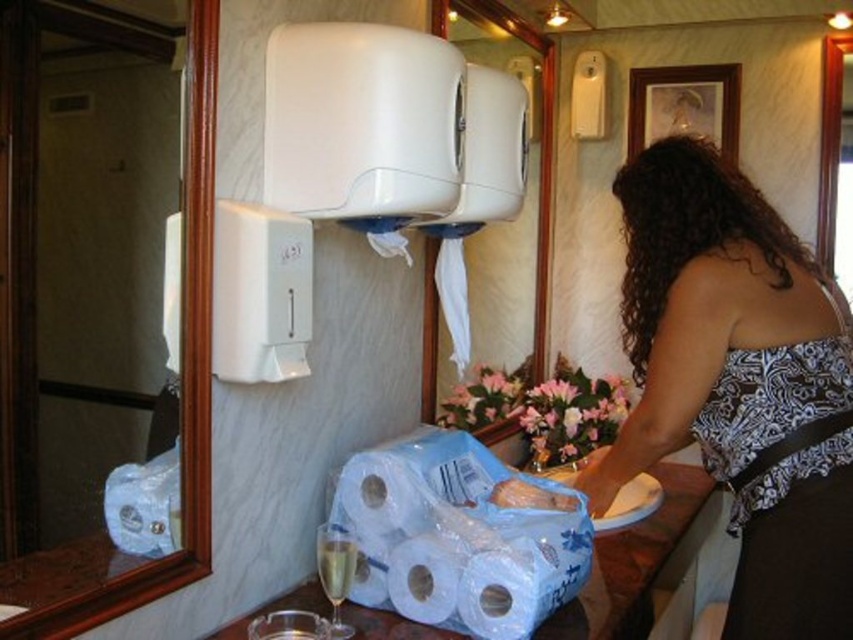
Question: Is white matte paper towel at lower center closer to the viewer compared to clear glass wine glass at lower left?

Choices:
 (A) no
 (B) yes

Answer: (A)

Question: Estimate the real-world distances between objects in this image. Which object is closer to the black satin apron at right?

Choices:
 (A) white glossy toilet paper at lower center
 (B) white matte paper towel at lower center

Answer: (A)

Question: Where is black satin apron at right located in relation to white glossy toilet paper at lower center in the image?

Choices:
 (A) above
 (B) below

Answer: (A)

Question: Where is patterned fabric top at center located in relation to clear glass wine glass at lower left in the image?

Choices:
 (A) below
 (B) above

Answer: (B)

Question: Among these objects, which one is nearest to the camera?

Choices:
 (A) clear glass wine glass at lower left
 (B) patterned fabric top at center

Answer: (A)

Question: Considering the real-world distances, which object is farthest from the white glossy toilet paper at lower left?

Choices:
 (A) patterned fabric top at center
 (B) black satin apron at right
 (C) white glossy toilet paper at lower center
 (D) clear glass wine glass at lower left

Answer: (B)